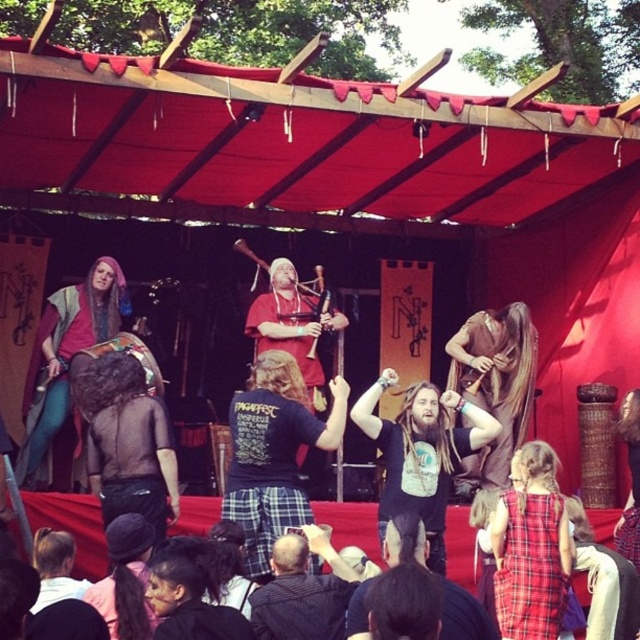
Question: Can you confirm if black cotton t-shirt at center is bigger than dark gray plaid shirt at center?

Choices:
 (A) yes
 (B) no

Answer: (A)

Question: Which point is farther from the camera taking this photo?

Choices:
 (A) (493, 339)
 (B) (266, 586)
 (C) (531, 573)
 (D) (116, 429)

Answer: (A)

Question: Which object appears closest to the camera in this image?

Choices:
 (A) black leather pants at lower left
 (B) matte red tunic at center
 (C) plaid fabric dress at lower right
 (D) black cotton t-shirt at center

Answer: (A)

Question: Is black leather pants at lower left smaller than dark gray plaid shirt at center?

Choices:
 (A) no
 (B) yes

Answer: (A)

Question: Considering the relative positions of black leather pants at lower left and matte red tunic at center in the image provided, where is black leather pants at lower left located with respect to matte red tunic at center?

Choices:
 (A) below
 (B) above

Answer: (A)

Question: Which point appears farthest from the camera in this image?

Choices:
 (A) (552, 499)
 (B) (508, 480)

Answer: (B)